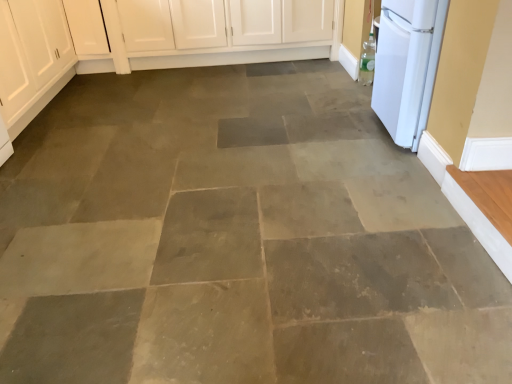
Question: Should I look upward or downward to see white matte refrigerator at right?

Choices:
 (A) down
 (B) up

Answer: (B)

Question: Does matte white cabinet at left have a greater width compared to white matte refrigerator at right?

Choices:
 (A) no
 (B) yes

Answer: (B)

Question: From the image's perspective, is matte white cabinet at left on white matte refrigerator at right?

Choices:
 (A) yes
 (B) no

Answer: (A)

Question: From a real-world perspective, is matte white cabinet at left beneath white matte refrigerator at right?

Choices:
 (A) no
 (B) yes

Answer: (B)

Question: Is matte white cabinet at left turned away from white matte refrigerator at right?

Choices:
 (A) no
 (B) yes

Answer: (A)

Question: Is matte white cabinet at left bigger than white matte refrigerator at right?

Choices:
 (A) no
 (B) yes

Answer: (B)

Question: Is the depth of matte white cabinet at left greater than that of white matte refrigerator at right?

Choices:
 (A) no
 (B) yes

Answer: (B)

Question: Is white matte refrigerator at right oriented towards matte white cabinet at left?

Choices:
 (A) no
 (B) yes

Answer: (B)

Question: Is white matte refrigerator at right to the right of matte white cabinet at left from the viewer's perspective?

Choices:
 (A) yes
 (B) no

Answer: (A)

Question: From a real-world perspective, is white matte refrigerator at right located higher than matte white cabinet at left?

Choices:
 (A) yes
 (B) no

Answer: (A)

Question: Is white matte refrigerator at right positioned in front of matte white cabinet at left?

Choices:
 (A) no
 (B) yes

Answer: (B)

Question: Would you say white matte refrigerator at right is outside matte white cabinet at left?

Choices:
 (A) no
 (B) yes

Answer: (B)

Question: Considering the relative positions of white matte refrigerator at right and matte white cabinet at left in the image provided, is white matte refrigerator at right to the left of matte white cabinet at left from the viewer's perspective?

Choices:
 (A) no
 (B) yes

Answer: (A)

Question: Looking at their shapes, would you say white matte refrigerator at right is wider or thinner than matte white cabinet at left?

Choices:
 (A) thin
 (B) wide

Answer: (A)